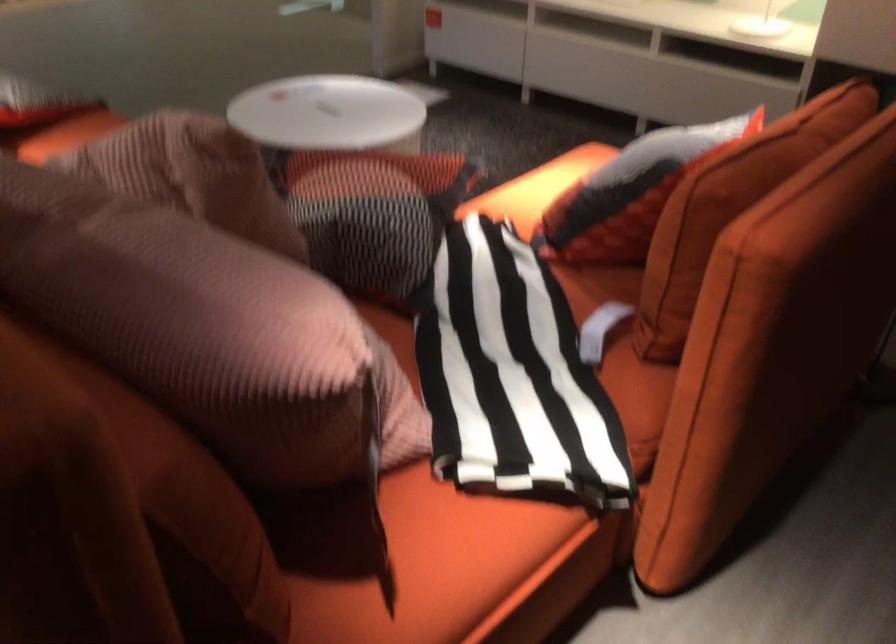
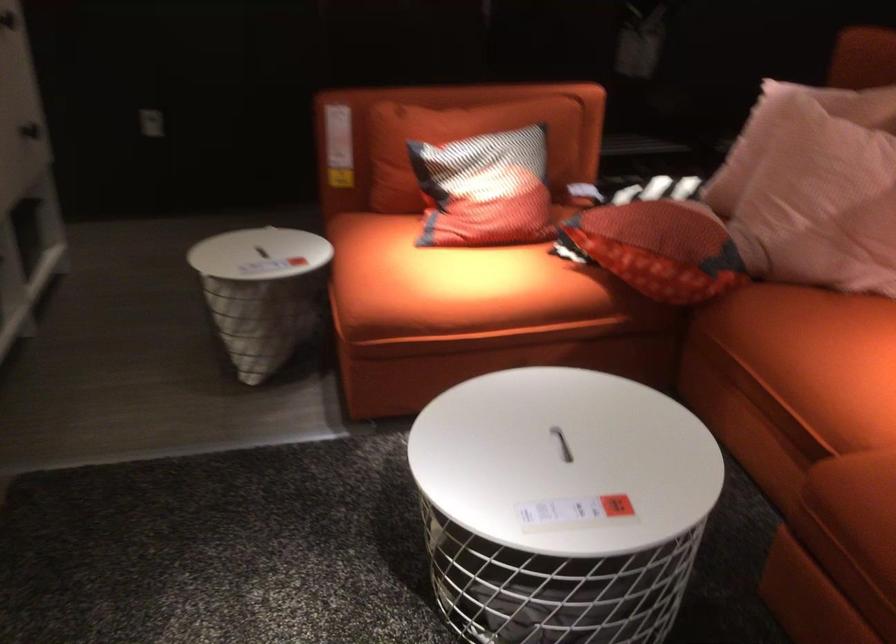
Locate, in the second image, the point that corresponds to pixel 547 169 in the first image.

(449, 281)